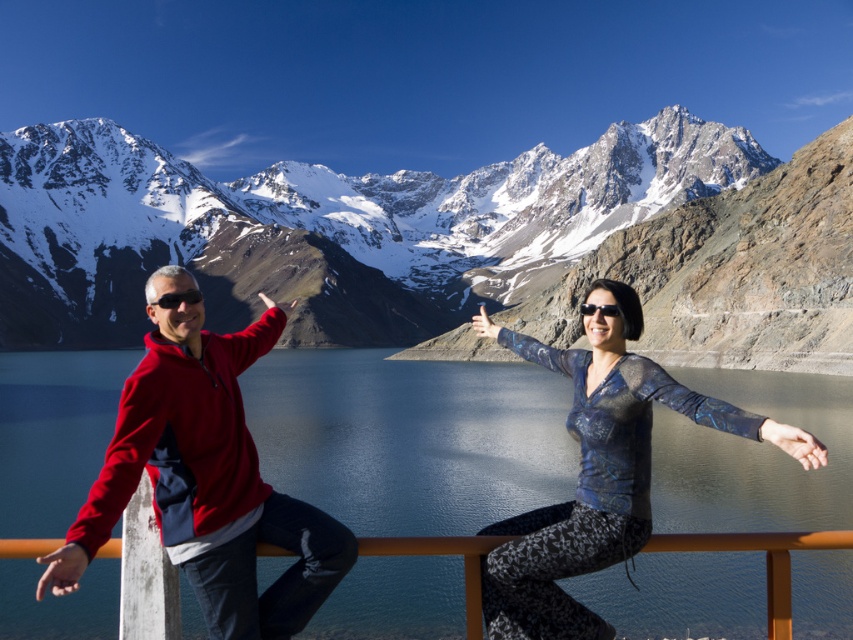
Question: Which of the following is the closest to the observer?

Choices:
 (A) (471, 582)
 (B) (819, 502)
 (C) (523, 176)
 (D) (346, 545)

Answer: (A)

Question: Which object is positioned farthest from the snowy granite mountain range at upper center?

Choices:
 (A) metallic blue blouse at center
 (B) blue glassy water at lower left

Answer: (A)

Question: Which object is positioned closest to the metallic blue blouse at center?

Choices:
 (A) black plastic sunglasses at upper center
 (B) wooden railing at lower center

Answer: (B)

Question: Considering the relative positions of metallic blue blouse at center and black plastic sunglasses at upper center in the image provided, where is metallic blue blouse at center located with respect to black plastic sunglasses at upper center?

Choices:
 (A) left
 (B) right

Answer: (B)

Question: Does snowy granite mountain range at upper center have a lesser width compared to black plastic sunglasses at upper center?

Choices:
 (A) no
 (B) yes

Answer: (A)

Question: Is metallic blue blouse at center smaller than wooden railing at lower center?

Choices:
 (A) yes
 (B) no

Answer: (B)